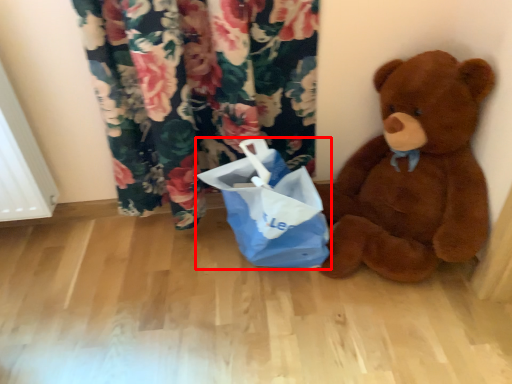
Question: From the image's perspective, what is the correct spatial positioning of shopping bag (annotated by the red box) in reference to teddy bear?

Choices:
 (A) below
 (B) above

Answer: (A)